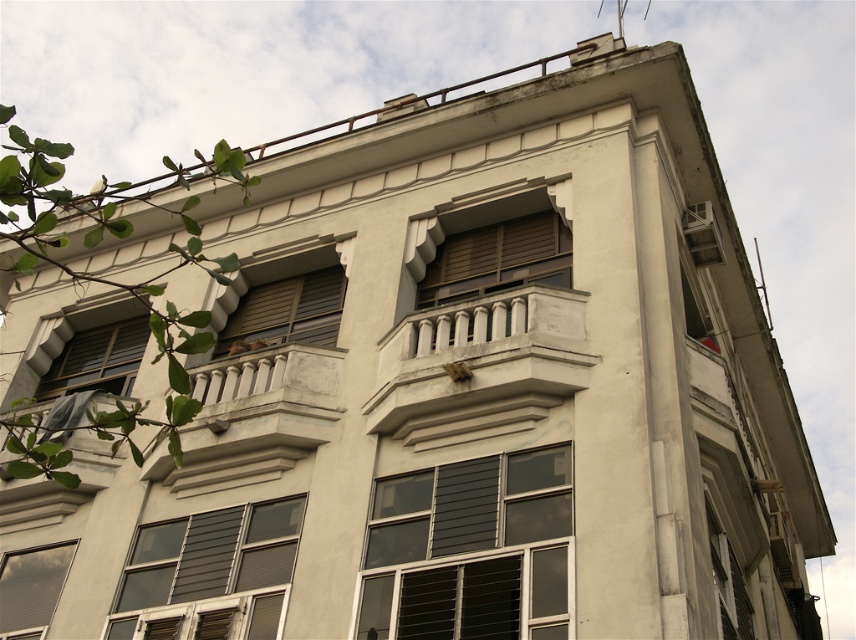
Question: Can you confirm if matte gray window at lower left is bigger than matte brown window at left?

Choices:
 (A) no
 (B) yes

Answer: (A)

Question: Which point appears farthest from the camera in this image?

Choices:
 (A) (224, 388)
 (B) (512, 604)
 (C) (171, 564)

Answer: (A)

Question: Estimate the real-world distances between objects in this image. Which object is closer to the matte brown window at left?

Choices:
 (A) wooden slats at center
 (B) transparent glass window at lower right

Answer: (A)

Question: Estimate the real-world distances between objects in this image. Which object is closer to the transparent glass window at lower right?

Choices:
 (A) matte brown window at left
 (B) matte gray window at lower left
 (C) wooden slats at center
 (D) matte glass window at lower left

Answer: (B)

Question: Is white stone balcony at center further to the viewer compared to matte gray window at lower left?

Choices:
 (A) no
 (B) yes

Answer: (A)

Question: Can you confirm if white stone balcony at center is bigger than matte glass window at lower left?

Choices:
 (A) no
 (B) yes

Answer: (B)